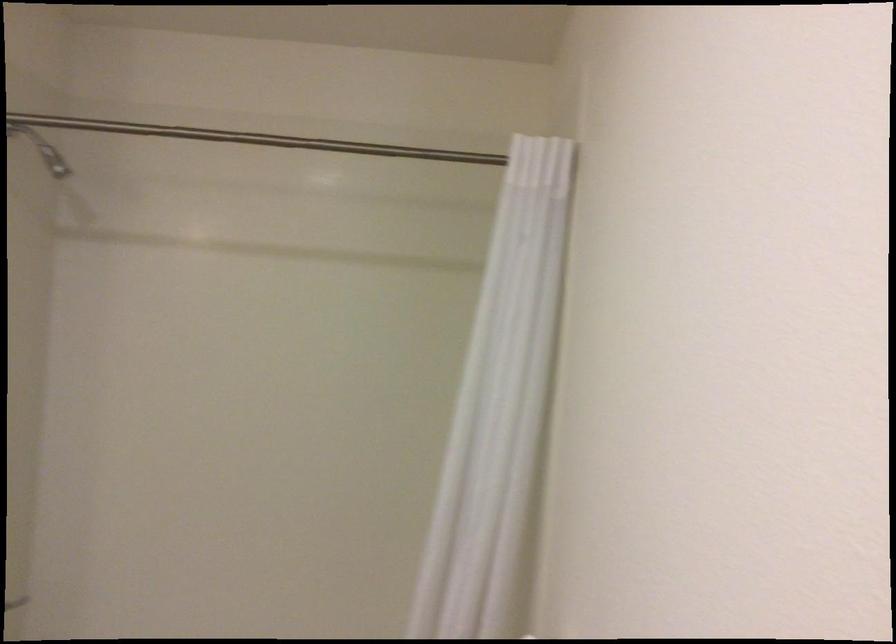
Locate an element on the screen. This screenshot has height=644, width=896. white shower curtain is located at coordinates (510, 390).